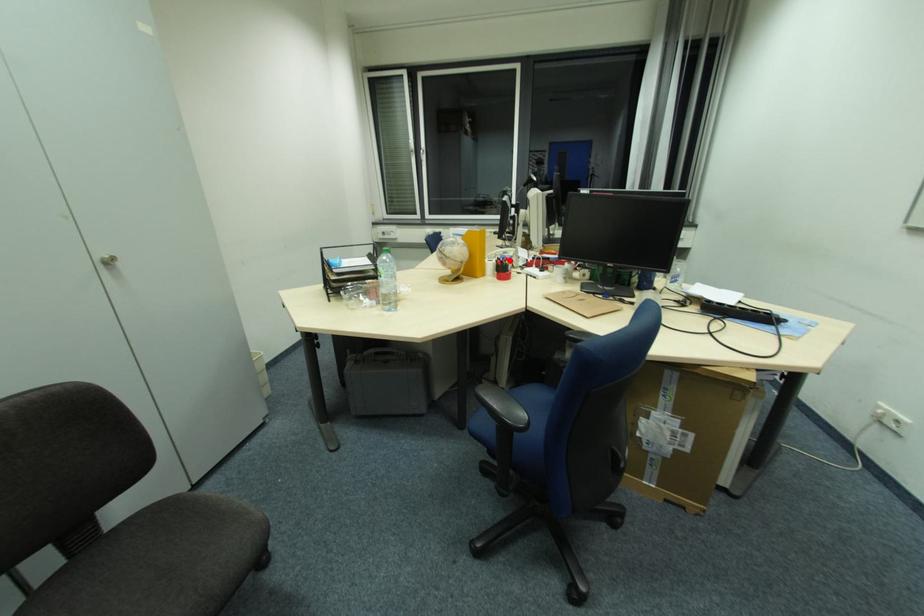
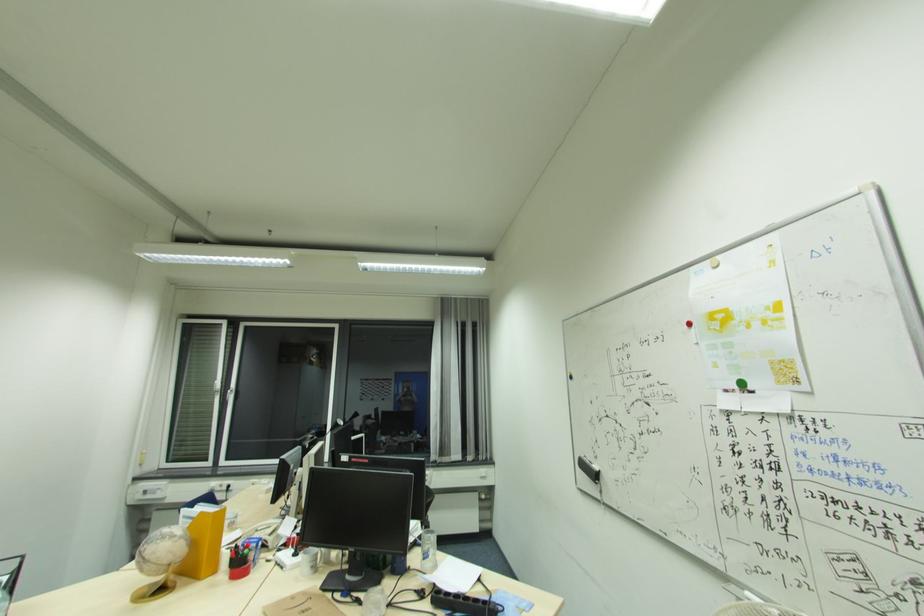
Where in the second image is the point corresponding to the highlighted location from the first image?

(250, 548)